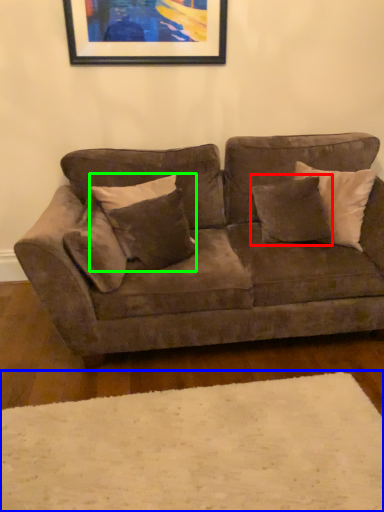
Question: Which is farther away from pillow (highlighted by a red box)? plain (highlighted by a blue box) or pillow (highlighted by a green box)?

Choices:
 (A) plain
 (B) pillow

Answer: (A)